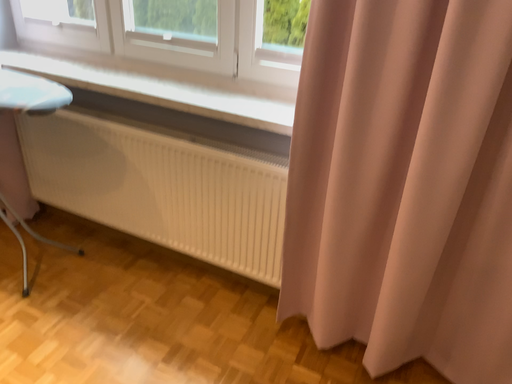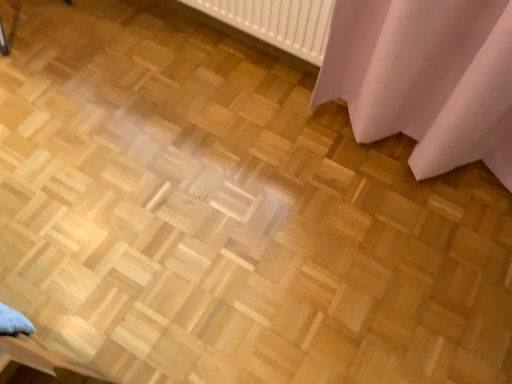
Question: Which way did the camera rotate in the video?

Choices:
 (A) rotated upward
 (B) rotated downward

Answer: (B)